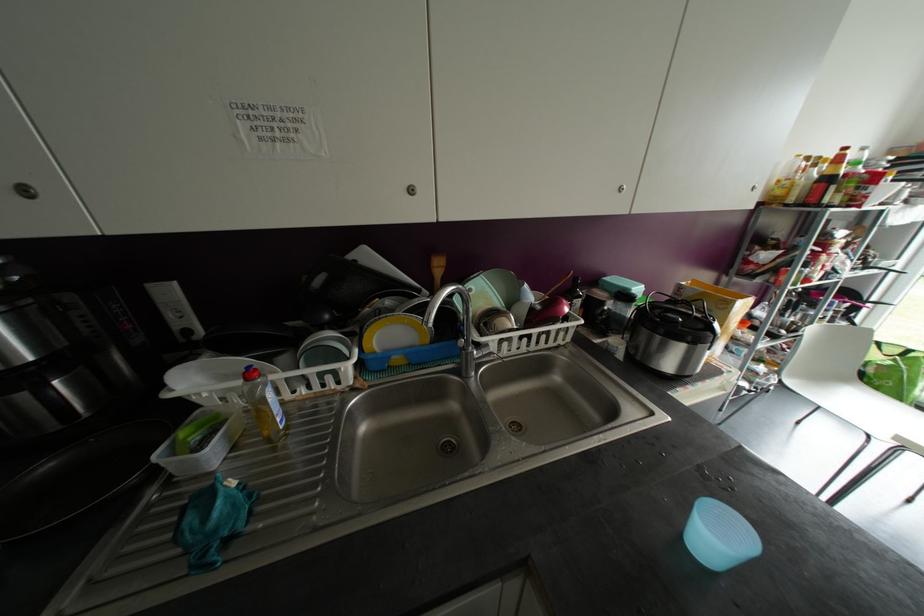
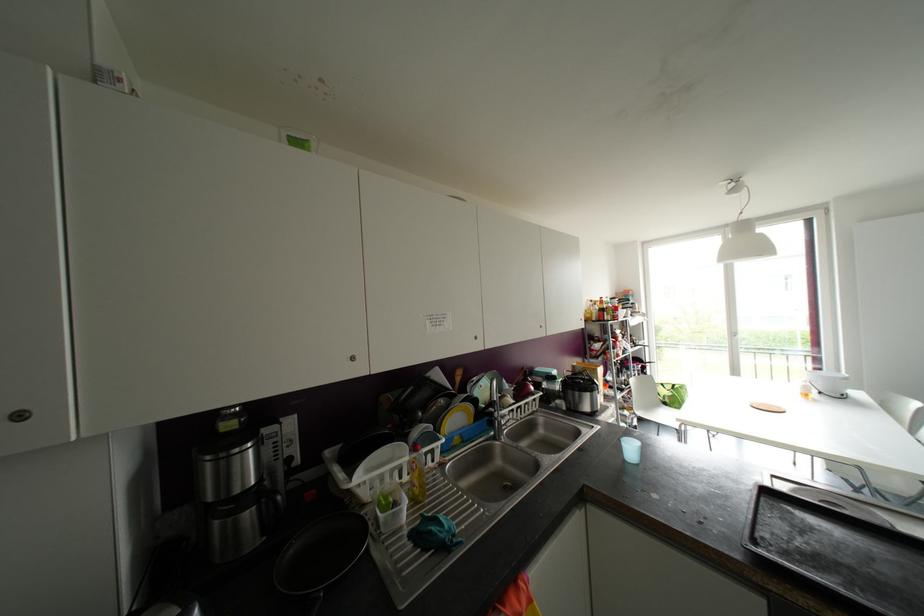
In the second image, find the point that corresponds to (x=852, y=403) in the first image.

(663, 416)